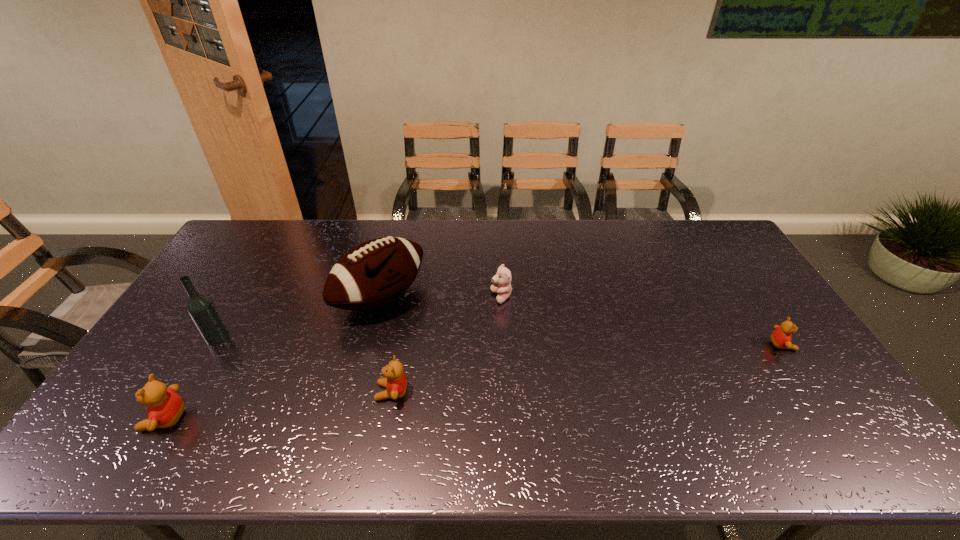
Where is `vacant space in between the second teddy bear from left to right and the tallest teddy bear`? This screenshot has width=960, height=540. vacant space in between the second teddy bear from left to right and the tallest teddy bear is located at coordinates (278, 406).

At what (x,y) coordinates should I click in order to perform the action: click on vacant area that lies between the third teddy bear from left to right and the football (American). Please return your answer as a coordinate pair (x, y). Looking at the image, I should click on (441, 298).

This screenshot has height=540, width=960. I want to click on vacant region between the rightmost object and the vodka, so (500, 342).

I want to click on vacant point located between the vodka and the farthest teddy bear, so click(x=360, y=318).

Identify the location of free space between the third nearest teddy bear and the vodka. (500, 342).

I want to click on object that is the fifth closest one to the fourth shortest object, so click(781, 338).

What are the coordinates of `the second closest object to the rightmost teddy bear` in the screenshot? It's located at (376, 272).

Identify which teddy bear is located as the second nearest to the football (American). Please provide its 2D coordinates. Your answer should be formatted as a tuple, i.e. [(x, y)], where the tuple contains the x and y coordinates of a point satisfying the conditions above.

[(503, 278)]

Locate an element on the screen. teddy bear identified as the closest to the third teddy bear from right to left is located at coordinates (503, 278).

I want to click on free space that satisfies the following two spatial constraints: 1. on the back side of the vodka; 2. on the left side of the football (American), so click(241, 299).